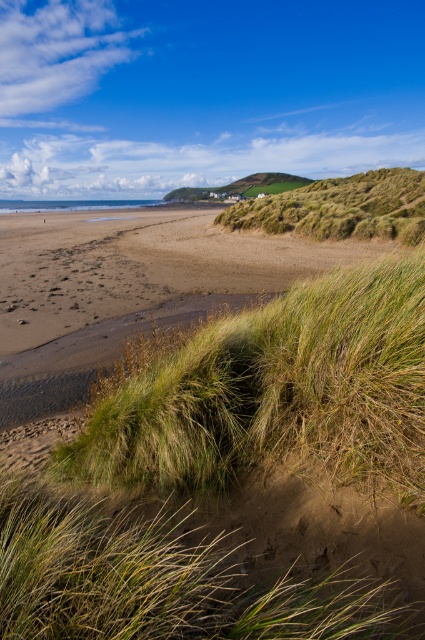
Who is positioned more to the left, green grassy at lower left or green grassy hill at upper right?

Positioned to the left is green grassy at lower left.

Can you confirm if green grassy at lower left is taller than green grassy hill at upper right?

No.

Does point (413, 632) come farther from viewer compared to point (353, 179)?

That is False.

Locate an element on the screen. The image size is (425, 640). green grassy at lower left is located at coordinates (163, 579).

Does brown sand at lower left appear over green grassy hill at upper right?

Actually, brown sand at lower left is below green grassy hill at upper right.

Can you confirm if brown sand at lower left is positioned to the right of green grassy hill at upper right?

Incorrect, brown sand at lower left is not on the right side of green grassy hill at upper right.

Where is `brown sand at lower left`? This screenshot has width=425, height=640. brown sand at lower left is located at coordinates (127, 288).

Measure the distance between green grassy at lower left and camera.

1.59 meters

Who is higher up, green grassy at lower left or brown sand at lower left?

Positioned higher is brown sand at lower left.

This screenshot has width=425, height=640. I want to click on green grassy at lower left, so click(163, 579).